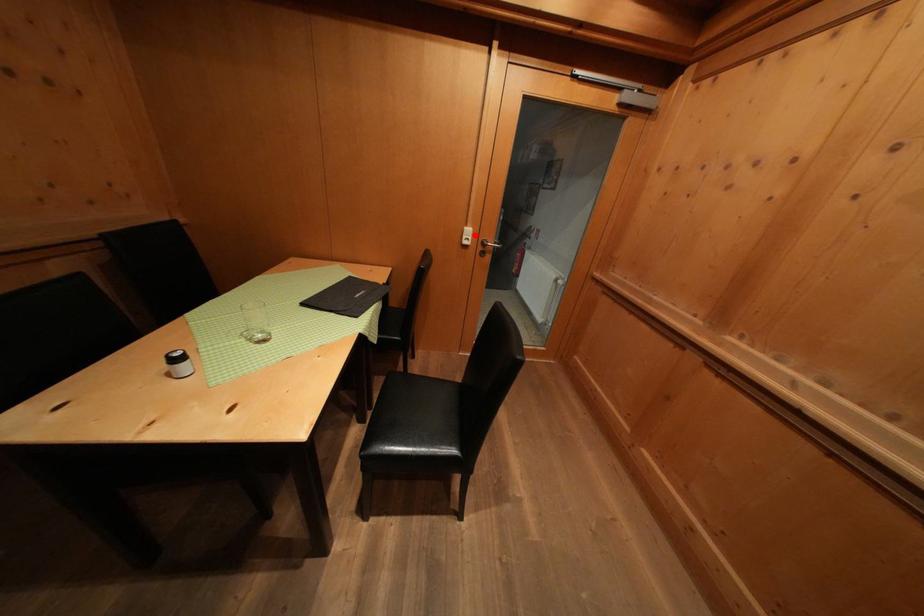
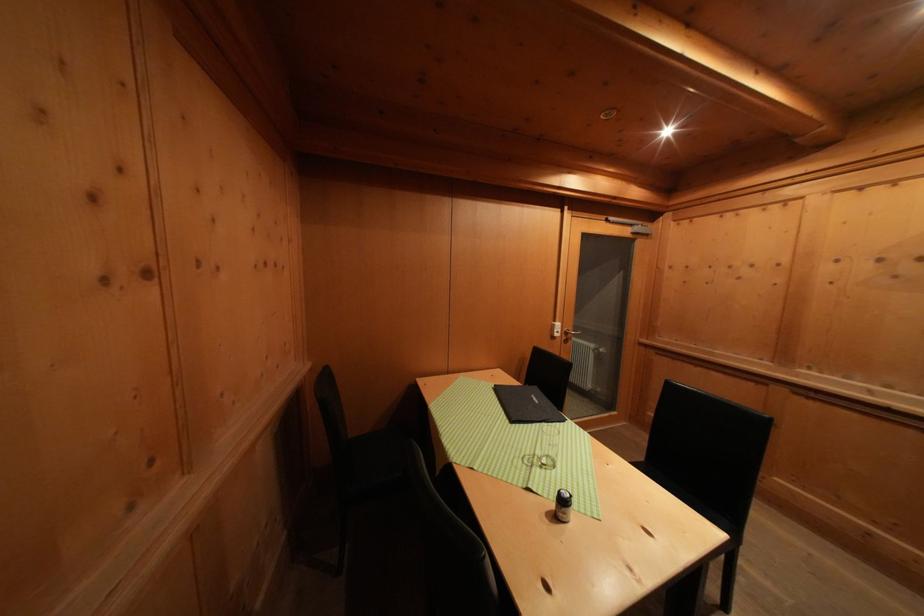
Find the pixel in the second image that matches the highlighted location in the first image.

(564, 330)